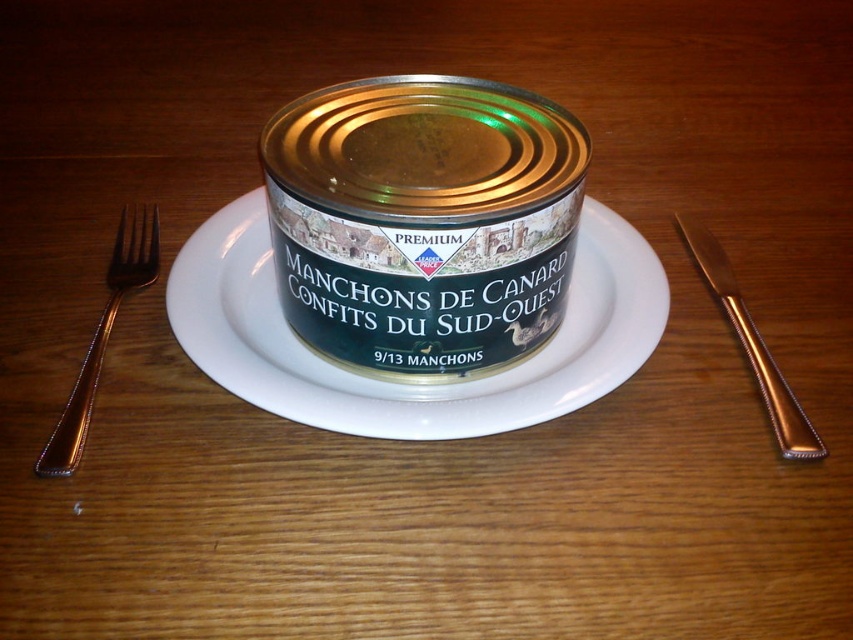
You have a gold polished fork at left and a gold metallic knife at right on a table. If you need to choose an utensil that can be used to spread a condiment evenly, which one would you pick and why?

The gold metallic knife at right is better for spreading condiments because knives typically have a flat, smooth edge designed for spreading, unlike the fork which has tines.

You are setting up a dining table and want to ensure that the white ceramic plate at center and the gold metallic knife at right will fit side by side without overlapping. Given their sizes, can both items be placed next to each other on the table without overlapping?

The white ceramic plate at center is wider than the gold metallic knife at right. Since the plate is wider, there should be enough space to place both items side by side without overlapping as long as the total width of both items does not exceed the table length.

You are standing in front of the wooden table with the can of Manchons de Canard Confits du Sud Ouest. There are two points marked on the table surface. The first point is at coordinates point (112, 323) and the second is at point (706, 280). Which point is closer to you?

Point (112, 323) is closer to the viewer than point (706, 280).